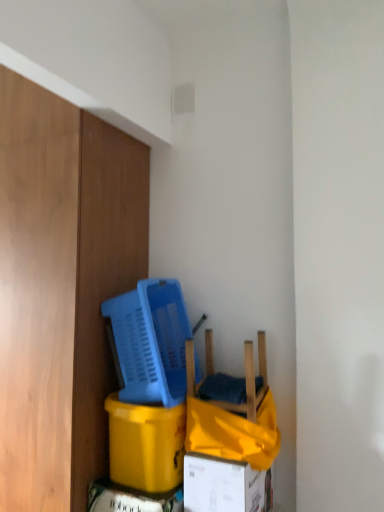
Question: From a real-world perspective, is white cardboard box at lower center positioned above or below blue plastic basket at center?

Choices:
 (A) below
 (B) above

Answer: (A)

Question: Relative to blue plastic basket at center, is white cardboard box at lower center in front or behind?

Choices:
 (A) behind
 (B) front

Answer: (B)

Question: Estimate the real-world distances between objects in this image. Which object is closer to the yellow cardboard box at lower left?

Choices:
 (A) blue plastic basket at center
 (B) wooden chair at lower center
 (C) white cardboard box at lower center

Answer: (C)

Question: Estimate the real-world distances between objects in this image. Which object is closer to the white cardboard box at lower center?

Choices:
 (A) yellow cardboard box at lower left
 (B) wooden chair at lower center
 (C) blue plastic basket at center

Answer: (A)